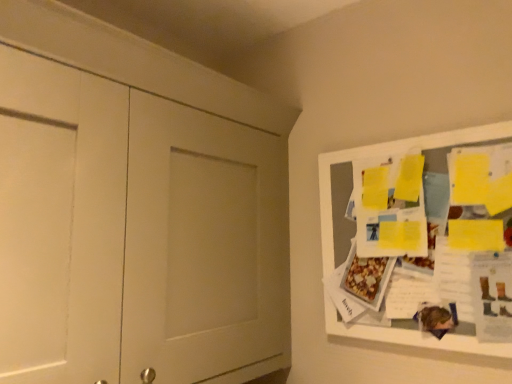
This screenshot has height=384, width=512. Describe the element at coordinates (135, 235) in the screenshot. I see `white matte door at left` at that location.

This screenshot has height=384, width=512. In order to click on white matte door at left in this screenshot , I will do `click(135, 235)`.

Describe the element at coordinates (387, 153) in the screenshot. The image size is (512, 384). I see `yellow paper at upper right` at that location.

Find the location of a particular element. yellow paper at upper right is located at coordinates (387, 153).

Locate an element on the screen. white matte door at left is located at coordinates (135, 235).

Visually, is yellow paper at upper right positioned to the left or to the right of white matte door at left?

yellow paper at upper right is to the right of white matte door at left.

Considering their positions, is yellow paper at upper right located in front of or behind white matte door at left?

In the image, yellow paper at upper right appears behind white matte door at left.

Considering the positions of point (405, 330) and point (109, 85), is point (405, 330) closer or farther from the camera than point (109, 85)?

Clearly, point (405, 330) is more distant from the camera than point (109, 85).

From the picture: From the image's perspective, is yellow paper at upper right beneath white matte door at left?

Indeed, from the image's perspective, yellow paper at upper right is shown beneath white matte door at left.

In the scene shown: From a real-world perspective, who is located higher, yellow paper at upper right or white matte door at left?

white matte door at left, from a real-world perspective.

Considering the relative sizes of yellow paper at upper right and white matte door at left in the image provided, is yellow paper at upper right wider than white matte door at left?

Incorrect, the width of yellow paper at upper right does not surpass that of white matte door at left.

Consider the image. Between yellow paper at upper right and white matte door at left, which one has less height?

With less height is yellow paper at upper right.

Consider the image. Considering the sizes of objects yellow paper at upper right and white matte door at left in the image provided, who is bigger, yellow paper at upper right or white matte door at left?

white matte door at left.

Choose the correct answer: Is yellow paper at upper right inside white matte door at left or outside it?

yellow paper at upper right is not enclosed by white matte door at left.

Is yellow paper at upper right next to white matte door at left?

yellow paper at upper right and white matte door at left are clearly separated.

Is yellow paper at upper right aimed at white matte door at left?

No, yellow paper at upper right is not oriented towards white matte door at left.

How many degrees apart are the facing directions of yellow paper at upper right and white matte door at left?

89.7 degrees.

Locate an element on the screen. The image size is (512, 384). bulletin board beneath the white matte door at left (from a real-world perspective) is located at coordinates (387, 153).

Considering the positions of objects white matte door at left and yellow paper at upper right in the image provided, who is more to the right, white matte door at left or yellow paper at upper right?

From the viewer's perspective, yellow paper at upper right appears more on the right side.

Which object is further away from the camera taking this photo, white matte door at left or yellow paper at upper right?

yellow paper at upper right.

Does point (178, 256) appear closer or farther from the camera than point (323, 189)?

Point (178, 256) is closer to the camera than point (323, 189).

From the image's perspective, is white matte door at left above yellow paper at upper right?

Indeed, from the image's perspective, white matte door at left is shown above yellow paper at upper right.

From a real-world perspective, who is located lower, white matte door at left or yellow paper at upper right?

From a 3D spatial view, yellow paper at upper right is below.

Considering the sizes of objects white matte door at left and yellow paper at upper right in the image provided, who is wider, white matte door at left or yellow paper at upper right?

white matte door at left.

Is white matte door at left taller than yellow paper at upper right?

Indeed, white matte door at left has a greater height compared to yellow paper at upper right.

From the picture: In terms of size, does white matte door at left appear bigger or smaller than yellow paper at upper right?

In the image, white matte door at left appears to be larger than yellow paper at upper right.

Do you think white matte door at left is within yellow paper at upper right, or outside of it?

The correct answer is: outside.

Are white matte door at left and yellow paper at upper right far apart?

They are positioned close to each other.

Is white matte door at left looking in the opposite direction of yellow paper at upper right?

No, white matte door at left is not facing away from yellow paper at upper right.

How many degrees apart are the facing directions of white matte door at left and yellow paper at upper right?

The angular difference between white matte door at left and yellow paper at upper right is 89.7 degrees.

I want to click on bulletin board on the right of white matte door at left, so click(x=387, y=153).

What are the coordinates of `bulletin board on the right of white matte door at left` in the screenshot? It's located at (387, 153).

Image resolution: width=512 pixels, height=384 pixels. I want to click on bulletin board below the white matte door at left (from the image's perspective), so click(x=387, y=153).